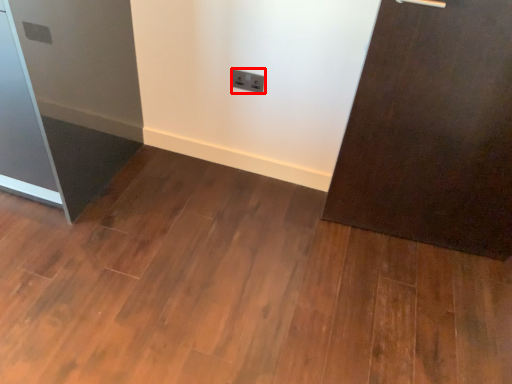
Question: From the image, what is the correct spatial relationship of electric outlet (annotated by the red box) in relation to fridge?

Choices:
 (A) right
 (B) left

Answer: (A)